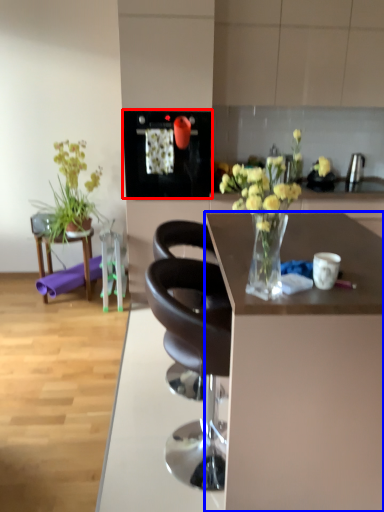
Question: Which object appears farthest to the camera in this image, appliance (highlighted by a red box) or desk (highlighted by a blue box)?

Choices:
 (A) appliance
 (B) desk

Answer: (A)